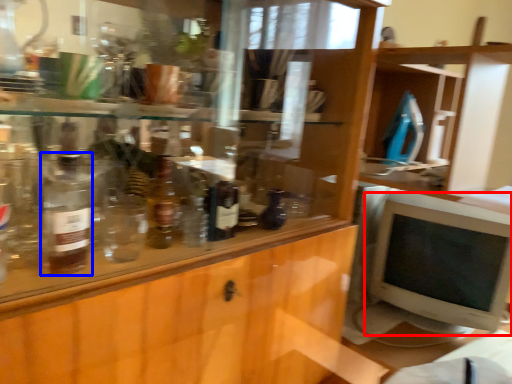
Question: Which object is further to the camera taking this photo, computer monitor (highlighted by a red box) or bottle (highlighted by a blue box)?

Choices:
 (A) computer monitor
 (B) bottle

Answer: (A)